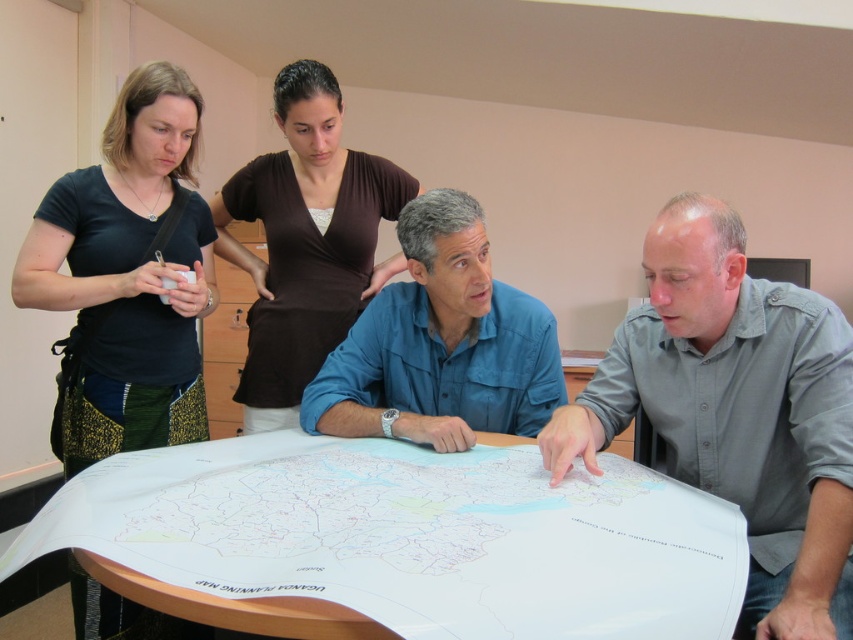
Is point (712, 538) more distant than point (666, 237)?

No, it is in front of (666, 237).

What are the coordinates of `white paper map at center` in the screenshot? It's located at (403, 541).

You are a GUI agent. You are given a task and a screenshot of the screen. Output one action in this format:
    pyautogui.click(x=<x>, y=<y>)
    Task: Click on the white paper map at center
    
    Given the screenshot: What is the action you would take?
    pyautogui.click(x=403, y=541)

Locate an element on the screen. The height and width of the screenshot is (640, 853). white paper map at center is located at coordinates (403, 541).

Is gray button-down shirt at lower right smaller than brown matte shirt at upper center?

Indeed, gray button-down shirt at lower right has a smaller size compared to brown matte shirt at upper center.

Image resolution: width=853 pixels, height=640 pixels. In order to click on gray button-down shirt at lower right in this screenshot , I will do tap(735, 410).

Which is below, gray button-down shirt at lower right or black fabric apron at left?

gray button-down shirt at lower right is lower down.

The image size is (853, 640). What are the coordinates of `gray button-down shirt at lower right` in the screenshot? It's located at (735, 410).